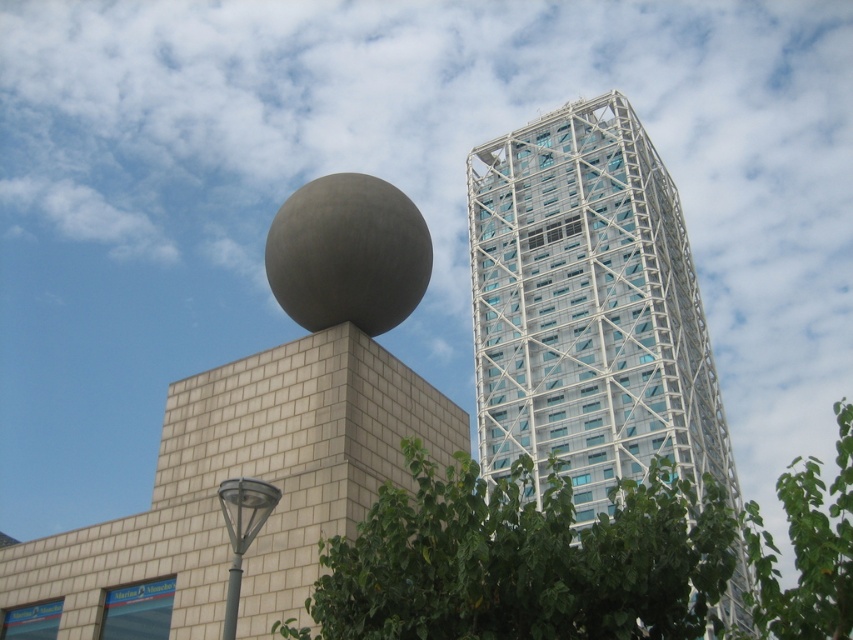
What do you see at coordinates (579, 560) in the screenshot?
I see `green leafy tree at center` at bounding box center [579, 560].

Which is behind, point (759, 596) or point (244, 513)?

The point (244, 513) is behind.

You are a GUI agent. You are given a task and a screenshot of the screen. Output one action in this format:
    pyautogui.click(x=<x>, y=<y>)
    Task: Click on the green leafy tree at center
    Image resolution: width=853 pixels, height=640 pixels.
    Given the screenshot: What is the action you would take?
    pyautogui.click(x=579, y=560)

Does white glass building at upper center appear over metallic gray streetlight at lower left?

Indeed, white glass building at upper center is positioned over metallic gray streetlight at lower left.

Which is more to the left, white glass building at upper center or metallic gray streetlight at lower left?

From the viewer's perspective, metallic gray streetlight at lower left appears more on the left side.

Is point (612, 426) farther from camera compared to point (236, 547)?

Yes, point (612, 426) is farther from viewer.

Image resolution: width=853 pixels, height=640 pixels. What are the coordinates of `white glass building at upper center` in the screenshot? It's located at (589, 308).

Between white glass building at upper center and green leafy tree at center, which one has more height?

Standing taller between the two is white glass building at upper center.

Does white glass building at upper center have a lesser width compared to green leafy tree at center?

Correct, white glass building at upper center's width is less than green leafy tree at center's.

Is point (497, 202) in front of point (555, 611)?

No, it is behind (555, 611).

The image size is (853, 640). Identify the location of white glass building at upper center. (589, 308).